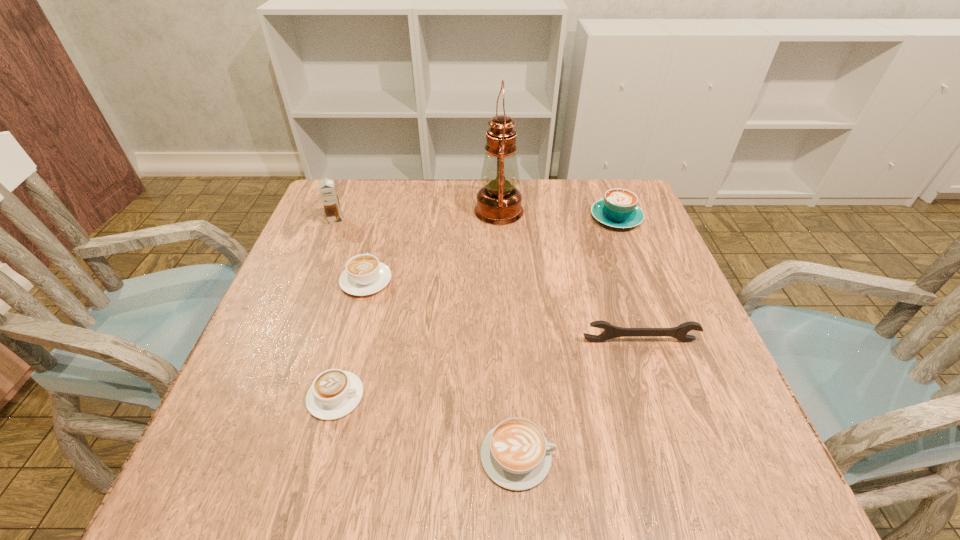
At what (x,y) coordinates should I click in order to perform the action: click on free area in between the third nearest cappuccino and the leftmost object. Please return your answer as a coordinate pair (x, y). Looking at the image, I should click on (351, 251).

I want to click on vacant region between the sixth shortest object and the second farthest cappuccino, so click(x=351, y=251).

At what (x,y) coordinates should I click in order to perform the action: click on vacant region between the oil lamp and the nearest object. Please return your answer as a coordinate pair (x, y). Image resolution: width=960 pixels, height=540 pixels. Looking at the image, I should click on (508, 333).

You are a GUI agent. You are given a task and a screenshot of the screen. Output one action in this format:
    pyautogui.click(x=<x>, y=<y>)
    Task: Click on the free space between the farthest cappuccino and the fifth farthest object
    Image resolution: width=960 pixels, height=540 pixels.
    Given the screenshot: What is the action you would take?
    pyautogui.click(x=628, y=279)

Select which object is the fourth closest to the tallest cappuccino. Please provide its 2D coordinates. Your answer should be formatted as a tuple, i.e. [(x, y)], where the tuple contains the x and y coordinates of a point satisfying the conditions above.

[(515, 454)]

Identify the location of object identified as the fifth closest to the leftmost object. This screenshot has width=960, height=540. pos(515,454).

The image size is (960, 540). Identify the location of the third closest cappuccino to the tallest cappuccino. (335, 393).

Where is `the second closest cappuccino relative to the second farthest cappuccino`? The width and height of the screenshot is (960, 540). the second closest cappuccino relative to the second farthest cappuccino is located at coordinates (515, 454).

Where is `free space that satisfies the following two spatial constraints: 1. on the side of the tallest object with the handle; 2. on the right side of the fourth nearest object`? The width and height of the screenshot is (960, 540). free space that satisfies the following two spatial constraints: 1. on the side of the tallest object with the handle; 2. on the right side of the fourth nearest object is located at coordinates (385, 211).

Find the location of a particular element. Image resolution: width=960 pixels, height=540 pixels. vacant area in the image that satisfies the following two spatial constraints: 1. on the back side of the tallest object; 2. on the right side of the leftmost object is located at coordinates (340, 211).